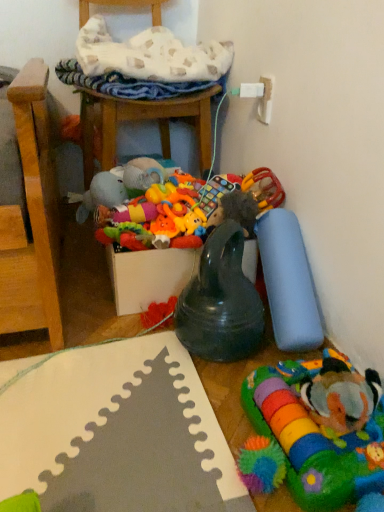
Identify the location of vacant region to the left of multicolored plush toy at lower right, marked as the 4th toy in a left-to-right arrangement. click(x=196, y=430).